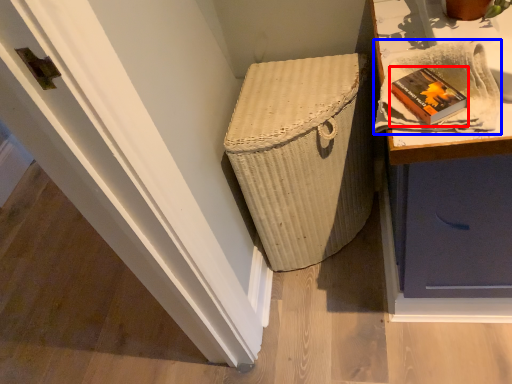
Question: Which point is further to the camera, book (highlighted by a red box) or cloth (highlighted by a blue box)?

Choices:
 (A) book
 (B) cloth

Answer: (A)